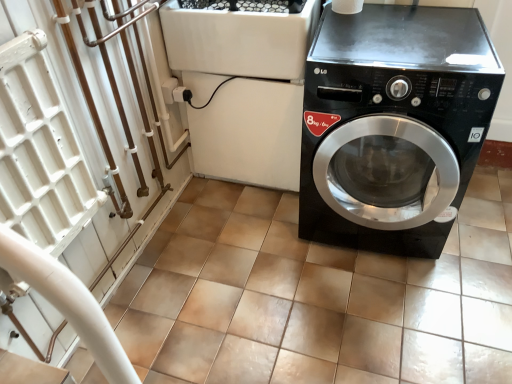
Identify the location of free space that is in between black glossy washing machine at right and black plastic washing machine at center. The width and height of the screenshot is (512, 384). tap(256, 211).